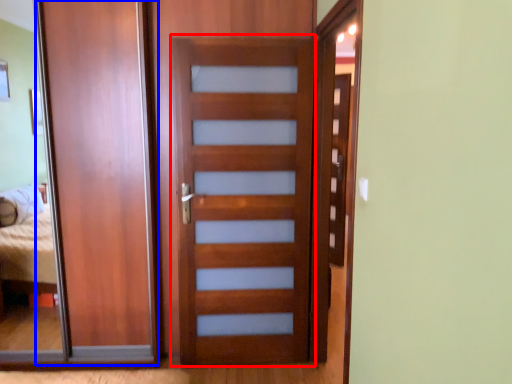
Question: Which object appears closest to the camera in this image, screen door (highlighted by a red box) or barn door (highlighted by a blue box)?

Choices:
 (A) screen door
 (B) barn door

Answer: (A)